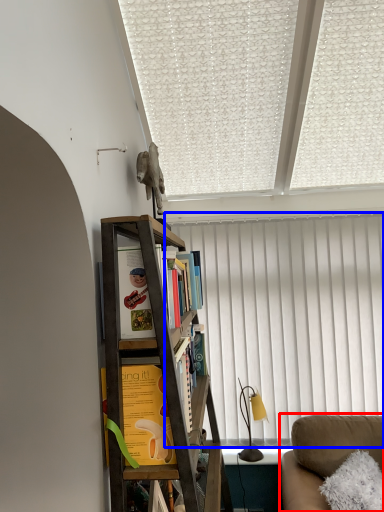
Question: Which object is further to the camera taking this photo, studio couch (highlighted by a red box) or curtain (highlighted by a blue box)?

Choices:
 (A) studio couch
 (B) curtain

Answer: (B)